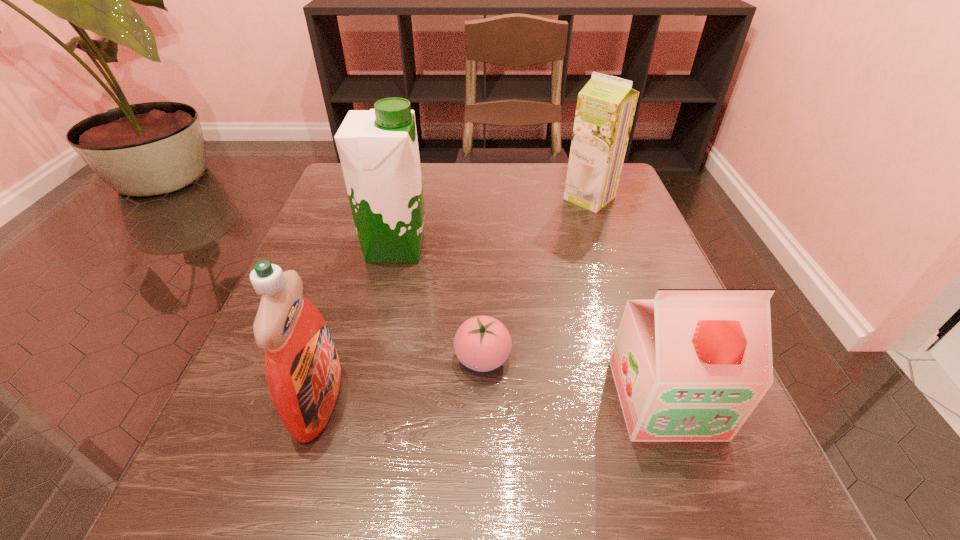
The image size is (960, 540). In order to click on the fourth nearest object in this screenshot , I will do `click(378, 148)`.

This screenshot has width=960, height=540. What are the coordinates of `the leftmost soya milk` in the screenshot? It's located at (378, 148).

In order to click on the farthest object in this screenshot , I will do `click(606, 105)`.

At what (x,y) coordinates should I click in order to perform the action: click on detergent. Please return your answer as a coordinate pair (x, y). Looking at the image, I should click on (302, 368).

The height and width of the screenshot is (540, 960). What are the coordinates of `the shortest soya milk` in the screenshot? It's located at (691, 365).

Image resolution: width=960 pixels, height=540 pixels. I want to click on the nearest soya milk, so point(691,365).

In order to click on the third object from left to right in this screenshot , I will do `click(482, 343)`.

At what (x,y) coordinates should I click in order to perform the action: click on the shortest object. Please return your answer as a coordinate pair (x, y). Looking at the image, I should click on (482, 343).

Locate an element on the screen. The height and width of the screenshot is (540, 960). blank space located on the front-facing side of the fourth nearest object is located at coordinates (625, 247).

You are a GUI agent. You are given a task and a screenshot of the screen. Output one action in this format:
    pyautogui.click(x=<x>, y=<y>)
    Task: Click on the free space located 0.340m on the front of the farthest soya milk
    The width and height of the screenshot is (960, 540).
    Given the screenshot: What is the action you would take?
    pyautogui.click(x=634, y=327)